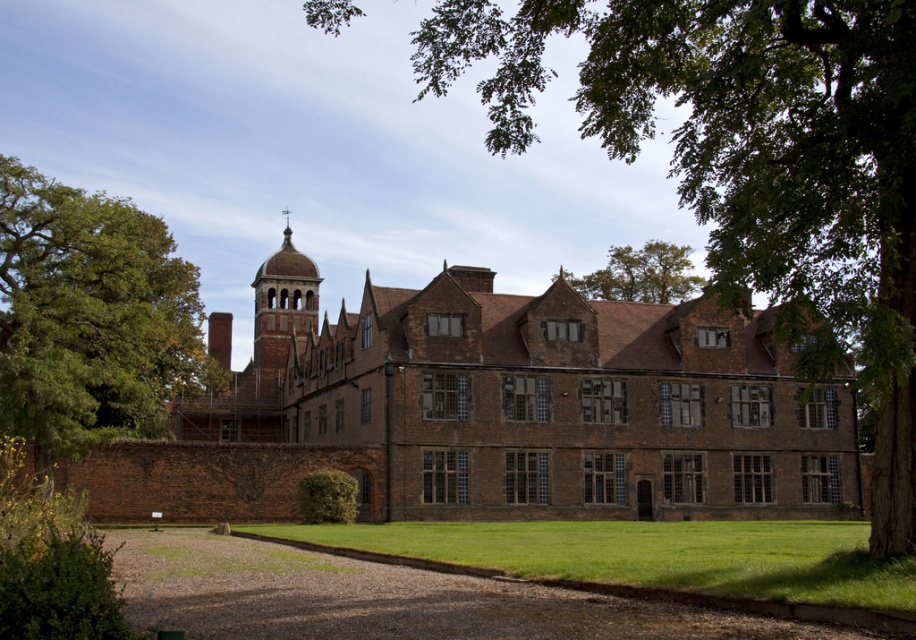
Question: Which object is the farthest from the green leafy tree at upper right?

Choices:
 (A) green leafy tree at left
 (B) green leafy tree at upper center

Answer: (B)

Question: Does green leafy tree at left come in front of green leafy tree at upper center?

Choices:
 (A) no
 (B) yes

Answer: (B)

Question: Can you confirm if green leafy tree at upper right is positioned below green leafy tree at left?

Choices:
 (A) no
 (B) yes

Answer: (A)

Question: Does green leafy tree at upper right have a greater width compared to green leafy tree at upper center?

Choices:
 (A) no
 (B) yes

Answer: (B)

Question: Among these points, which one is farthest from the camera?

Choices:
 (A) (840, 326)
 (B) (674, 275)

Answer: (B)

Question: Which point appears farthest from the camera in this image?

Choices:
 (A) (771, 193)
 (B) (572, 282)
 (C) (148, 401)

Answer: (B)